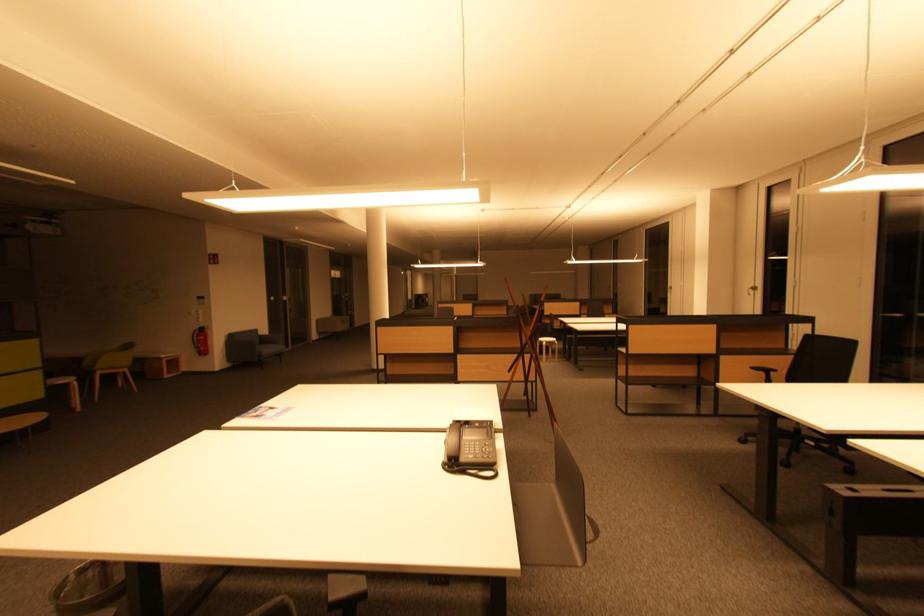
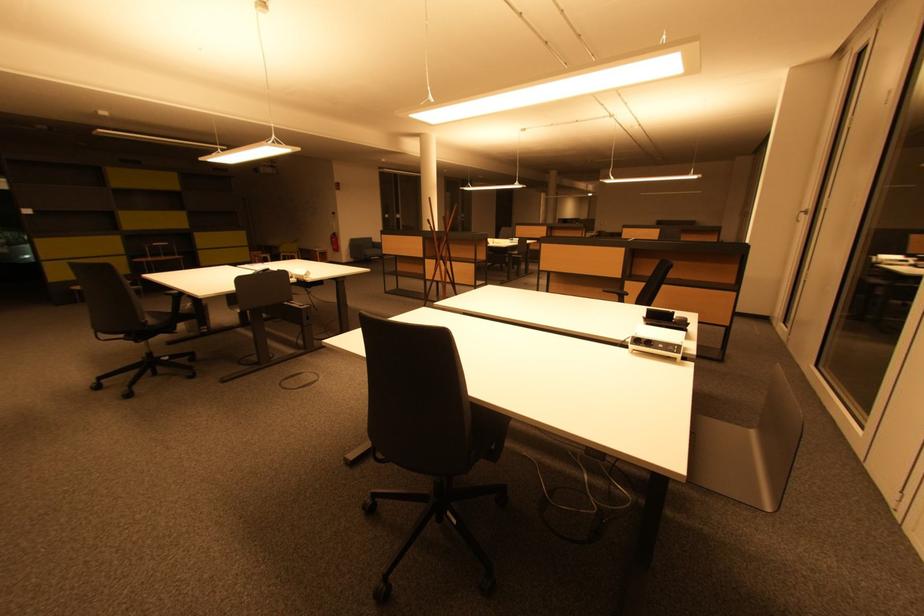
Where in the second image is the point corresponding to (205,339) from the first image?

(338, 241)